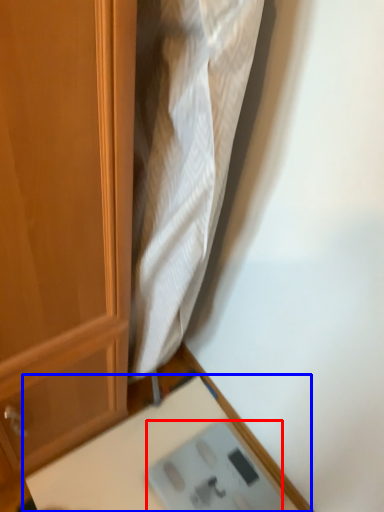
Question: Which point is closer to the camera, scale (highlighted by a red box) or table (highlighted by a blue box)?

Choices:
 (A) scale
 (B) table

Answer: (B)